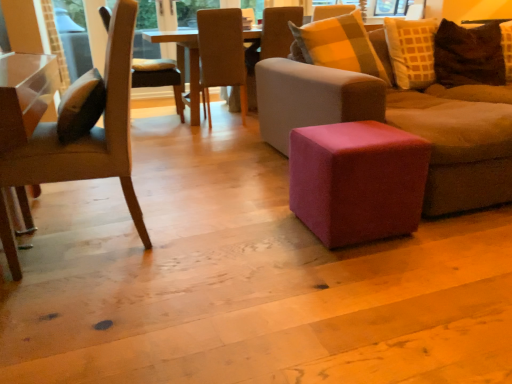
Question: Can we say brown textured pillow at upper right lies outside light beige fabric chair at upper center, positioned as the 2th chair in back-to-front order?

Choices:
 (A) no
 (B) yes

Answer: (B)

Question: From the image's perspective, does brown textured pillow at upper right appear higher than light beige fabric chair at upper center, positioned as the 2th chair in back-to-front order?

Choices:
 (A) no
 (B) yes

Answer: (A)

Question: Is brown textured pillow at upper right next to light beige fabric chair at upper center, positioned as the 2th chair in back-to-front order?

Choices:
 (A) yes
 (B) no

Answer: (B)

Question: Can you confirm if brown textured pillow at upper right is shorter than light beige fabric chair at upper center, positioned as the 2th chair in back-to-front order?

Choices:
 (A) no
 (B) yes

Answer: (B)

Question: From the image's perspective, is brown textured pillow at upper right below light beige fabric chair at upper center, the 3th chair when ordered from front to back?

Choices:
 (A) no
 (B) yes

Answer: (B)

Question: Considering the relative sizes of brown textured pillow at upper right and light beige fabric chair at upper center, the 3th chair when ordered from front to back, in the image provided, is brown textured pillow at upper right wider than light beige fabric chair at upper center, the 3th chair when ordered from front to back,?

Choices:
 (A) no
 (B) yes

Answer: (A)

Question: Is pink fabric stool at center surrounded by beige fabric chair at center, acting as the 3th chair starting from the back?

Choices:
 (A) yes
 (B) no

Answer: (B)

Question: Does beige fabric chair at center, acting as the 2th chair starting from the front, have a larger size compared to pink fabric stool at center?

Choices:
 (A) yes
 (B) no

Answer: (A)

Question: Is beige fabric chair at center, acting as the 3th chair starting from the back, facing towards pink fabric stool at center?

Choices:
 (A) no
 (B) yes

Answer: (A)

Question: Does beige fabric chair at center, acting as the 2th chair starting from the front, have a lesser width compared to pink fabric stool at center?

Choices:
 (A) no
 (B) yes

Answer: (A)

Question: From a real-world perspective, is beige fabric chair at center, acting as the 2th chair starting from the front, under pink fabric stool at center?

Choices:
 (A) yes
 (B) no

Answer: (B)

Question: Considering the relative positions of beige fabric chair at center, acting as the 3th chair starting from the back, and pink fabric stool at center in the image provided, is beige fabric chair at center, acting as the 3th chair starting from the back, in front of pink fabric stool at center?

Choices:
 (A) no
 (B) yes

Answer: (A)

Question: From the image's perspective, is wooden chair at center, which is the fourth chair from front to back, above brown textured pillow at upper right?

Choices:
 (A) no
 (B) yes

Answer: (B)